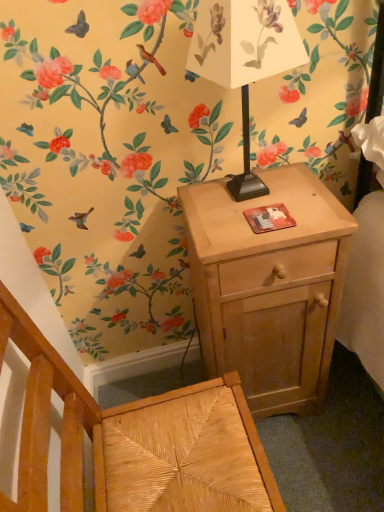
Question: From a real-world perspective, is white paper lampshade at upper center positioned over woven wood armchair at lower left based on gravity?

Choices:
 (A) yes
 (B) no

Answer: (A)

Question: Is white paper lampshade at upper center facing towards woven wood armchair at lower left?

Choices:
 (A) yes
 (B) no

Answer: (B)

Question: Is white paper lampshade at upper center thinner than woven wood armchair at lower left?

Choices:
 (A) yes
 (B) no

Answer: (A)

Question: Does white paper lampshade at upper center come in front of woven wood armchair at lower left?

Choices:
 (A) yes
 (B) no

Answer: (B)

Question: From the image's perspective, would you say white paper lampshade at upper center is shown under woven wood armchair at lower left?

Choices:
 (A) no
 (B) yes

Answer: (A)

Question: From a real-world perspective, relative to white paper lampshade at upper center, is woven wood armchair at lower left vertically above or below?

Choices:
 (A) below
 (B) above

Answer: (A)

Question: Which is correct: woven wood armchair at lower left is inside white paper lampshade at upper center, or outside of it?

Choices:
 (A) outside
 (B) inside

Answer: (A)

Question: Is woven wood armchair at lower left bigger or smaller than white paper lampshade at upper center?

Choices:
 (A) small
 (B) big

Answer: (B)

Question: Relative to white paper lampshade at upper center, is woven wood armchair at lower left in front or behind?

Choices:
 (A) front
 (B) behind

Answer: (A)

Question: In terms of height, does woven wood armchair at lower left look taller or shorter compared to light wood nightstand at right?

Choices:
 (A) tall
 (B) short

Answer: (A)

Question: Is point (13, 314) positioned closer to the camera than point (271, 173)?

Choices:
 (A) farther
 (B) closer

Answer: (B)

Question: Which is correct: woven wood armchair at lower left is inside light wood nightstand at right, or outside of it?

Choices:
 (A) outside
 (B) inside

Answer: (A)

Question: Is woven wood armchair at lower left in front of or behind light wood nightstand at right in the image?

Choices:
 (A) front
 (B) behind

Answer: (A)

Question: From a real-world perspective, is light wood nightstand at right above or below woven wood armchair at lower left?

Choices:
 (A) below
 (B) above

Answer: (A)

Question: Visually, is light wood nightstand at right positioned to the left or to the right of woven wood armchair at lower left?

Choices:
 (A) left
 (B) right

Answer: (B)